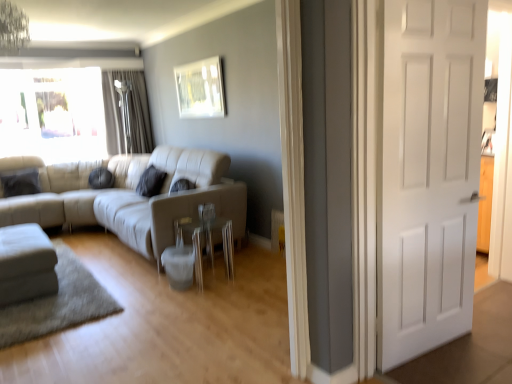
Locate an element on the screen. The image size is (512, 384). beige leather couch at center, which is the 2th studio couch in left-to-right order is located at coordinates (129, 196).

The image size is (512, 384). What do you see at coordinates (129, 196) in the screenshot? I see `beige leather couch at center, which is the 2th studio couch in left-to-right order` at bounding box center [129, 196].

What is the approximate width of white matte door at right?

The width of white matte door at right is 4.39 inches.

Measure the distance between metallic silver picture frame at upper center and camera.

The distance of metallic silver picture frame at upper center from camera is 4.64 meters.

The height and width of the screenshot is (384, 512). Describe the element at coordinates (207, 243) in the screenshot. I see `clear glass side table at center` at that location.

The image size is (512, 384). Identify the location of beige leather couch at center, which is the first studio couch in right-to-left order. (129, 196).

Is dark gray fabric curtain at upper left outside of clear glass side table at center?

Yes, dark gray fabric curtain at upper left is not within clear glass side table at center.

Does dark gray fabric curtain at upper left have a smaller size compared to clear glass side table at center?

No.

In the scene shown: Which point is more forward, (131, 124) or (195, 258)?

The point (195, 258) is in front.

From a real-world perspective, which is physically above, dark gray fabric curtain at upper left or clear glass side table at center?

dark gray fabric curtain at upper left is physically above.

Which point is more distant from viewer, (118, 133) or (236, 232)?

Point (118, 133)

The height and width of the screenshot is (384, 512). I want to click on curtain on the left of beige leather couch at center, which is the first studio couch in right-to-left order, so click(x=129, y=112).

Does dark gray fabric curtain at upper left have a lesser height compared to beige leather couch at center, which is the 2th studio couch in left-to-right order?

No.

Is dark gray fabric curtain at upper left bigger or smaller than beige leather couch at center, which is the 2th studio couch in left-to-right order?

Clearly, dark gray fabric curtain at upper left is smaller in size than beige leather couch at center, which is the 2th studio couch in left-to-right order.

From the picture: Choose the correct answer: Is dark gray fabric curtain at upper left inside white matte door at right or outside it?

dark gray fabric curtain at upper left is outside white matte door at right.

Considering the relative sizes of dark gray fabric curtain at upper left and white matte door at right in the image provided, is dark gray fabric curtain at upper left smaller than white matte door at right?

Actually, dark gray fabric curtain at upper left might be larger than white matte door at right.

Can you confirm if dark gray fabric curtain at upper left is taller than white matte door at right?

In fact, dark gray fabric curtain at upper left may be shorter than white matte door at right.

From the image's perspective, is dark gray fabric curtain at upper left on white matte door at right?

Yes, from the image's perspective, dark gray fabric curtain at upper left is on top of white matte door at right.

Can you confirm if white fabric ottoman at lower left, acting as the second studio couch starting from the right, is taller than clear glass side table at center?

No.

Is white fabric ottoman at lower left, the first studio couch from the left, oriented towards clear glass side table at center?

No, white fabric ottoman at lower left, the first studio couch from the left, is not oriented towards clear glass side table at center.

Measure the distance between white fabric ottoman at lower left, the first studio couch from the left, and clear glass side table at center.

A distance of 3.98 feet exists between white fabric ottoman at lower left, the first studio couch from the left, and clear glass side table at center.

Which is behind, point (232, 263) or point (117, 99)?

The point (117, 99) is behind.

From the image's perspective, would you say clear glass side table at center is shown under dark gray fabric curtain at upper left?

Yes, from the image's perspective, clear glass side table at center is beneath dark gray fabric curtain at upper left.

Can you tell me how much clear glass side table at center and dark gray fabric curtain at upper left differ in facing direction?

There is a 90.3-degree angle between the facing directions of clear glass side table at center and dark gray fabric curtain at upper left.

From a real-world perspective, who is located higher, clear glass side table at center or dark gray fabric curtain at upper left?

dark gray fabric curtain at upper left.

Is clear glass side table at center at the right side of white fabric ottoman at lower left, the first studio couch from the left?

Yes, clear glass side table at center is to the right of white fabric ottoman at lower left, the first studio couch from the left.

You are a GUI agent. You are given a task and a screenshot of the screen. Output one action in this format:
    pyautogui.click(x=<x>, y=<y>)
    Task: Click on the side table above the white fabric ottoman at lower left, the first studio couch from the left (from the image's perspective)
    
    Given the screenshot: What is the action you would take?
    pyautogui.click(x=207, y=243)

Considering the relative sizes of clear glass side table at center and white fabric ottoman at lower left, acting as the second studio couch starting from the right, in the image provided, is clear glass side table at center wider than white fabric ottoman at lower left, acting as the second studio couch starting from the right,?

In fact, clear glass side table at center might be narrower than white fabric ottoman at lower left, acting as the second studio couch starting from the right.

Are clear glass side table at center and white fabric ottoman at lower left, the first studio couch from the left, beside each other?

No, clear glass side table at center is not touching white fabric ottoman at lower left, the first studio couch from the left.

Is white fabric ottoman at lower left, acting as the second studio couch starting from the right, far from beige leather couch at center, which is the first studio couch in right-to-left order?

Indeed, white fabric ottoman at lower left, acting as the second studio couch starting from the right, is not near beige leather couch at center, which is the first studio couch in right-to-left order.

Considering the relative sizes of white fabric ottoman at lower left, the first studio couch from the left, and beige leather couch at center, which is the first studio couch in right-to-left order, in the image provided, is white fabric ottoman at lower left, the first studio couch from the left, smaller than beige leather couch at center, which is the first studio couch in right-to-left order,?

Correct, white fabric ottoman at lower left, the first studio couch from the left, occupies less space than beige leather couch at center, which is the first studio couch in right-to-left order.

Is white fabric ottoman at lower left, the first studio couch from the left, thinner than beige leather couch at center, which is the 2th studio couch in left-to-right order?

No.

Image resolution: width=512 pixels, height=384 pixels. I want to click on curtain behind the clear glass side table at center, so click(x=129, y=112).

Locate an element on the screen. the 1st studio couch in front of the dark gray fabric curtain at upper left is located at coordinates click(x=129, y=196).

Looking at the image, which one is located closer to metallic silver picture frame at upper center, clear glass side table at center or white matte door at right?

Based on the image, clear glass side table at center appears to be nearer to metallic silver picture frame at upper center.

Which object lies nearer to the anchor point metallic silver picture frame at upper center, clear glass side table at center or beige leather couch at center, which is the 2th studio couch in left-to-right order?

Based on the image, beige leather couch at center, which is the 2th studio couch in left-to-right order, appears to be nearer to metallic silver picture frame at upper center.

When comparing their distances from beige leather couch at center, which is the first studio couch in right-to-left order, does white fabric ottoman at lower left, acting as the second studio couch starting from the right, or clear glass side table at center seem further?

white fabric ottoman at lower left, acting as the second studio couch starting from the right.

When comparing their distances from dark gray fabric curtain at upper left, does clear glass side table at center or white fabric ottoman at lower left, the first studio couch from the left, seem further?

clear glass side table at center.

Looking at the image, which one is located closer to white fabric ottoman at lower left, acting as the second studio couch starting from the right, clear glass side table at center or dark gray fabric curtain at upper left?

clear glass side table at center is positioned closer to the anchor white fabric ottoman at lower left, acting as the second studio couch starting from the right.

Which object lies nearer to the anchor point dark gray fabric curtain at upper left, white fabric ottoman at lower left, acting as the second studio couch starting from the right, or clear glass side table at center?

The object closer to dark gray fabric curtain at upper left is white fabric ottoman at lower left, acting as the second studio couch starting from the right.

Estimate the real-world distances between objects in this image. Which object is further from white matte door at right, beige leather couch at center, which is the 2th studio couch in left-to-right order, or clear glass side table at center?

beige leather couch at center, which is the 2th studio couch in left-to-right order, is positioned further to the anchor white matte door at right.

When comparing their distances from clear glass side table at center, does dark gray fabric curtain at upper left or white matte door at right seem further?

dark gray fabric curtain at upper left is further to clear glass side table at center.

Where is `studio couch between metallic silver picture frame at upper center and clear glass side table at center from top to bottom`? studio couch between metallic silver picture frame at upper center and clear glass side table at center from top to bottom is located at coordinates (129, 196).

This screenshot has width=512, height=384. Identify the location of studio couch located between white fabric ottoman at lower left, the first studio couch from the left, and clear glass side table at center in the left-right direction. (129, 196).

The image size is (512, 384). What are the coordinates of `picture frame between clear glass side table at center and dark gray fabric curtain at upper left from front to back` in the screenshot? It's located at (200, 89).

Find the location of a particular element. This screenshot has height=384, width=512. studio couch between metallic silver picture frame at upper center and white fabric ottoman at lower left, the first studio couch from the left, in the up-down direction is located at coordinates (129, 196).